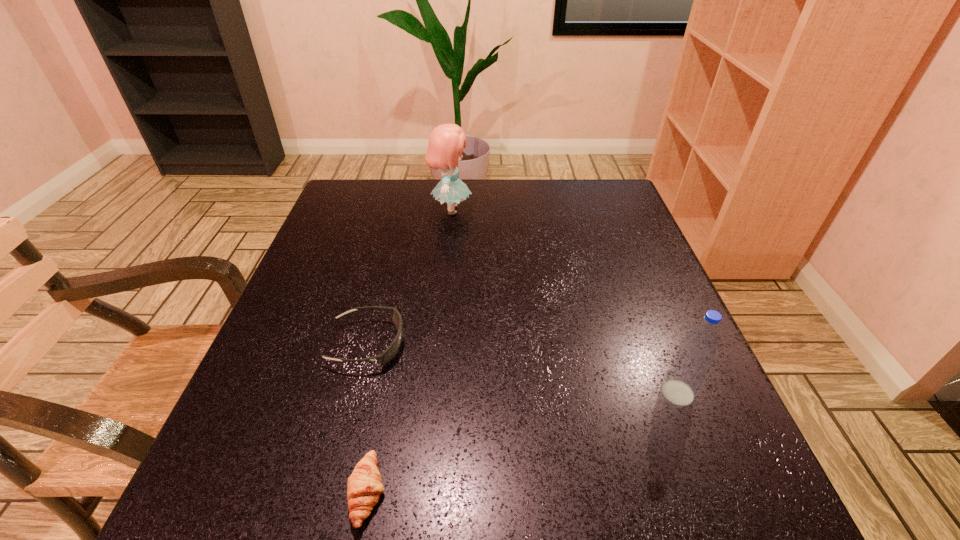
Where is `the farthest object`? The height and width of the screenshot is (540, 960). the farthest object is located at coordinates (446, 143).

Identify the location of doll. (446, 143).

Where is `the second tallest object`? the second tallest object is located at coordinates (689, 367).

Identify the location of the third farthest object. (689, 367).

Find the location of a particular element. goggles is located at coordinates (386, 356).

I want to click on the shortest object, so click(x=364, y=485).

At what (x,y) coordinates should I click in order to perform the action: click on pastry. Please return your answer as a coordinate pair (x, y). Looking at the image, I should click on (364, 485).

This screenshot has height=540, width=960. Identify the location of free spot located on the front-facing side of the doll. (517, 210).

The height and width of the screenshot is (540, 960). Identify the location of vacant region located on the left of the second nearest object. (455, 393).

Where is `free space located 0.250m on the lenses of the second farthest object`? This screenshot has height=540, width=960. free space located 0.250m on the lenses of the second farthest object is located at coordinates (538, 343).